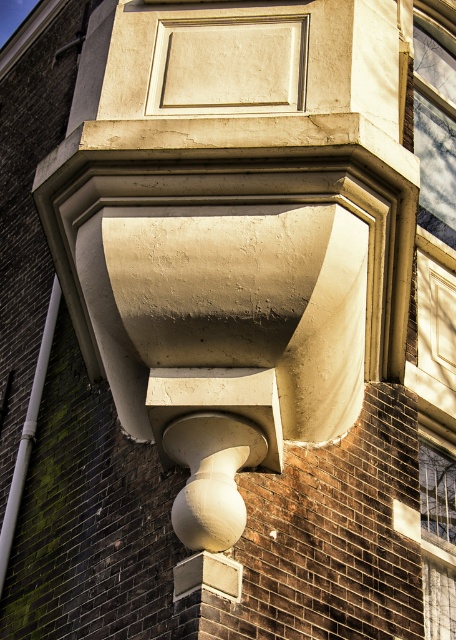
Question: Which object is farther from the camera taking this photo?

Choices:
 (A) matte concrete balcony at center
 (B) smooth glass window at upper right

Answer: (B)

Question: Observing the image, what is the correct spatial positioning of matte concrete balcony at center in reference to smooth glass window at upper right?

Choices:
 (A) below
 (B) above

Answer: (A)

Question: Does matte concrete balcony at center have a smaller size compared to smooth glass window at upper right?

Choices:
 (A) no
 (B) yes

Answer: (A)

Question: Does matte concrete balcony at center have a lesser width compared to smooth glass window at upper right?

Choices:
 (A) no
 (B) yes

Answer: (A)

Question: Which of the following is the closest to the observer?

Choices:
 (A) (186, 122)
 (B) (426, 131)

Answer: (A)